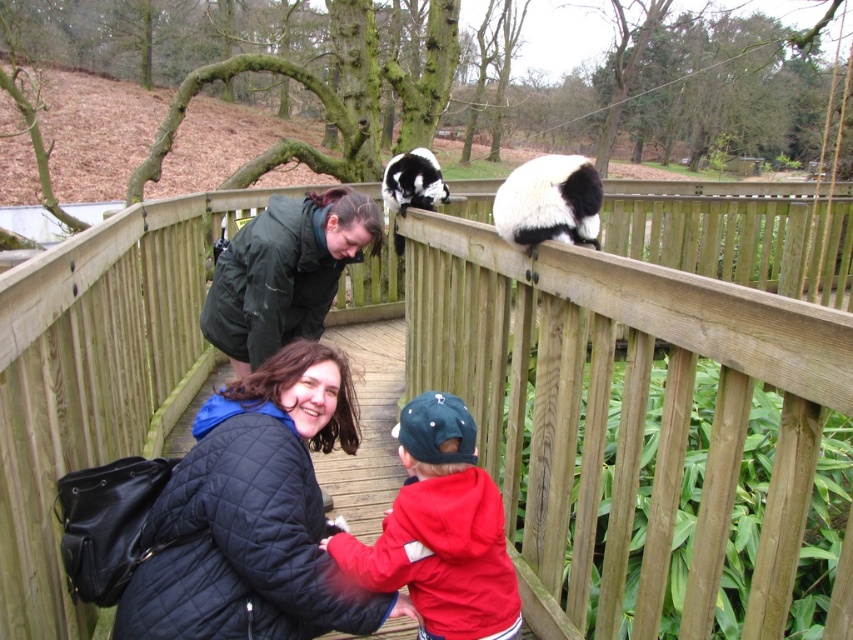
Question: Which object is positioned farthest from the black and white fur panda at upper center?

Choices:
 (A) dark green jacket at upper center
 (B) red fleece jacket at center
 (C) quilted black jacket at center
 (D) black and white fur at upper right

Answer: (B)

Question: Which object is positioned closest to the black and white fur panda at upper center?

Choices:
 (A) dark green jacket at upper center
 (B) quilted black jacket at center

Answer: (A)

Question: Which object appears closest to the camera in this image?

Choices:
 (A) dark green jacket at upper center
 (B) black and white fur at upper right
 (C) quilted black jacket at center

Answer: (C)

Question: Is black and white fur at upper right above black and white fur panda at upper center?

Choices:
 (A) no
 (B) yes

Answer: (A)

Question: Where is quilted black jacket at center located in relation to black and white fur at upper right in the image?

Choices:
 (A) left
 (B) right

Answer: (A)

Question: Can you confirm if dark green jacket at upper center is positioned below black and white fur panda at upper center?

Choices:
 (A) no
 (B) yes

Answer: (B)